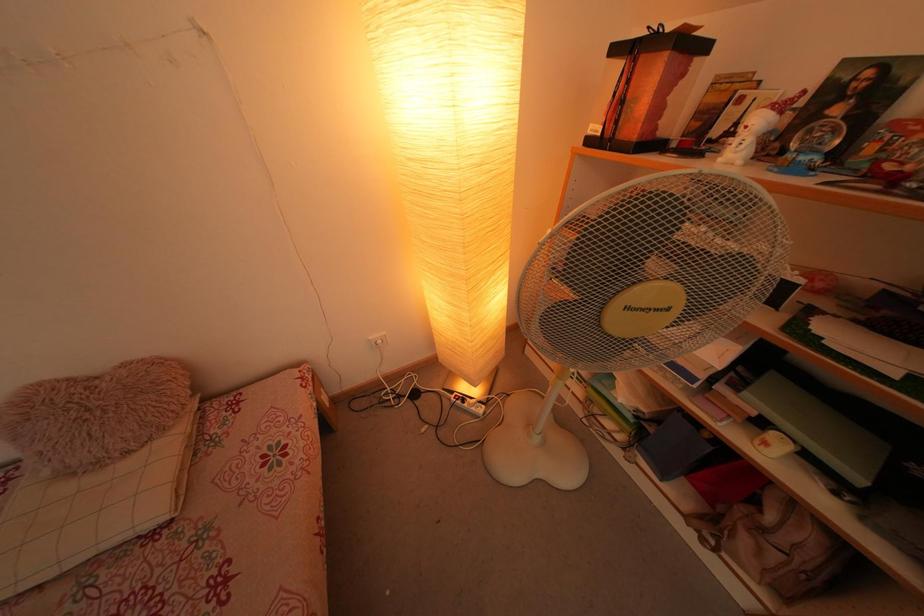
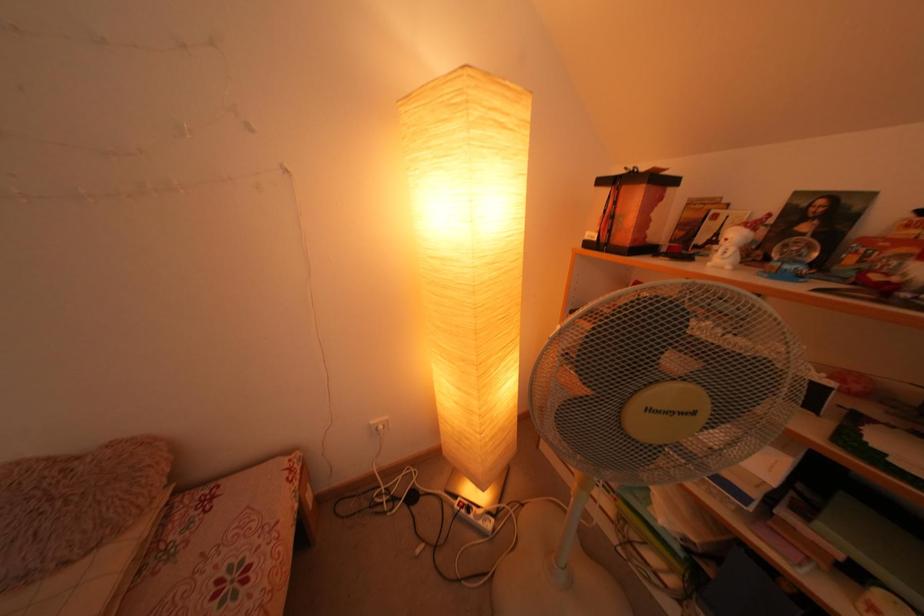
Which direction would the cameraman need to move to produce the second image?

The cameraman walked toward left, backward.